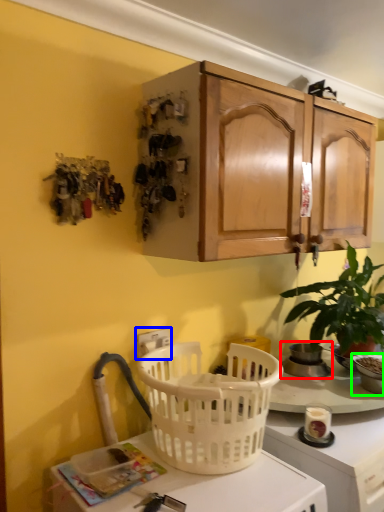
Question: Considering the real-world distances, which object is closest to appliance (highlighted by a red box)? electric outlet (highlighted by a blue box) or appliance (highlighted by a green box).

Choices:
 (A) electric outlet
 (B) appliance

Answer: (B)